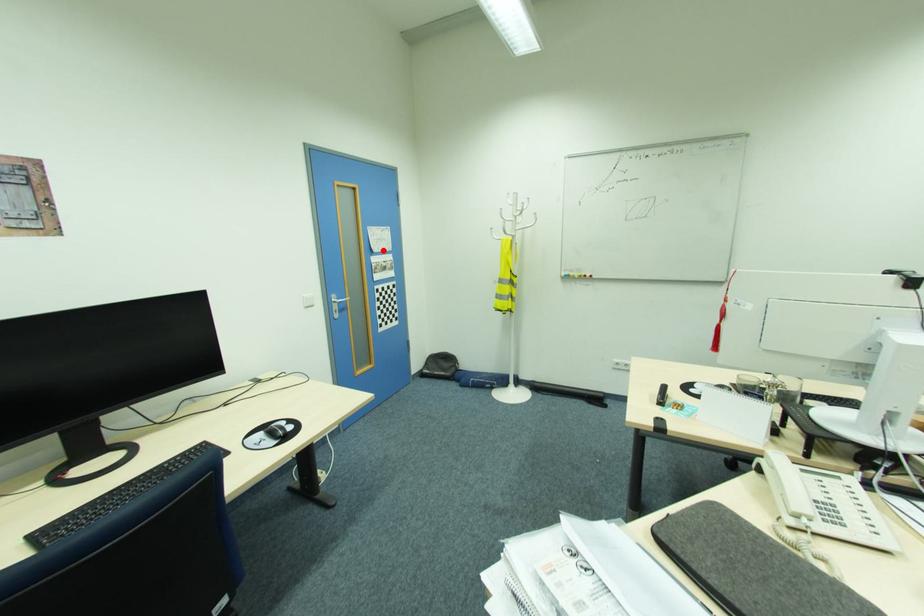
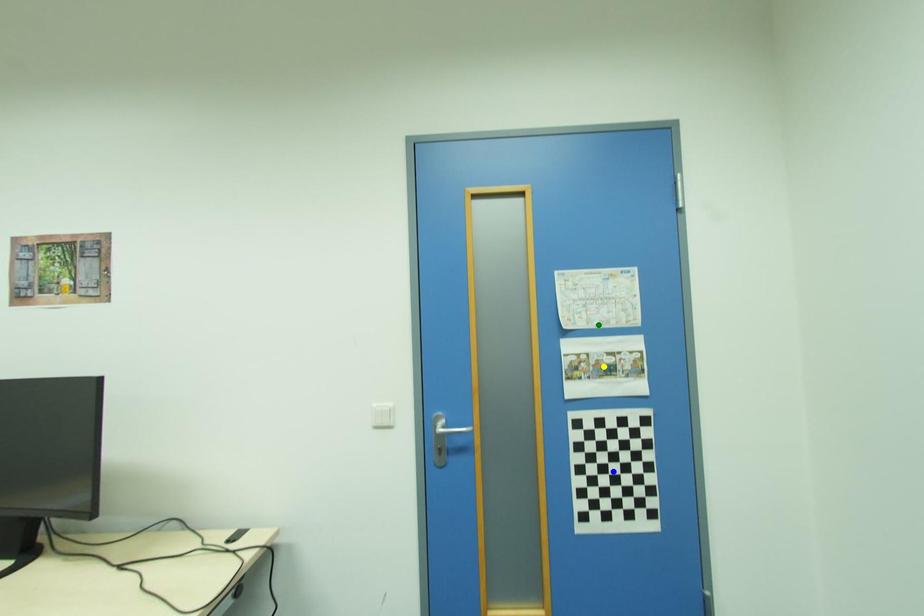
Question: I am providing you with two images of the same scene from different viewpoints. A red point is marked on the first image. You are given multiple points on the second image. Which spot in image 2 lines up with the point in image 1?

Choices:
 (A) blue point
 (B) green point
 (C) yellow point

Answer: (B)